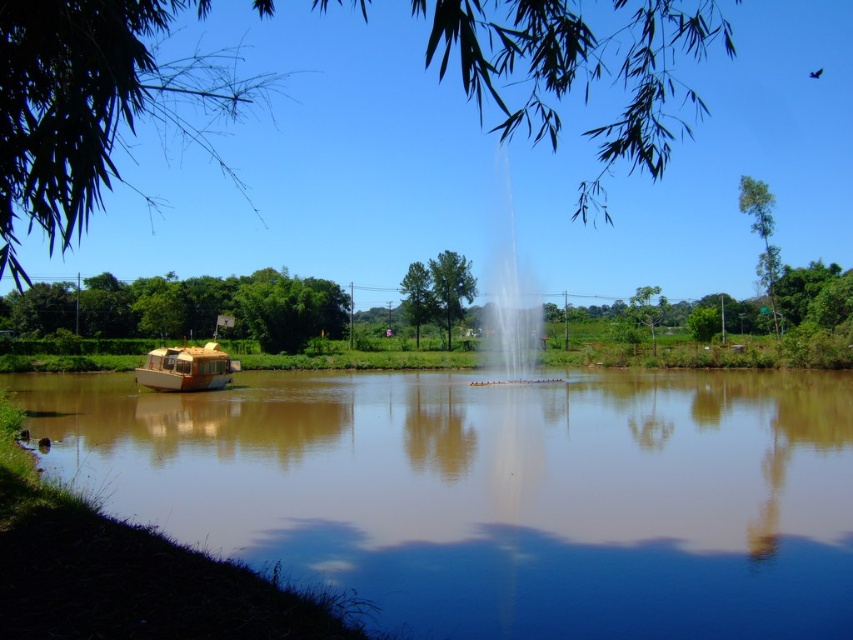
Who is lower down, green leafy tree at upper center or wooden boat at left?

wooden boat at left

Can you confirm if green leafy tree at upper center is positioned to the right of wooden boat at left?

Yes, green leafy tree at upper center is to the right of wooden boat at left.

This screenshot has height=640, width=853. Describe the element at coordinates (91, 106) in the screenshot. I see `green leafy tree at upper center` at that location.

Locate an element on the screen. This screenshot has height=640, width=853. green leafy tree at upper center is located at coordinates (91, 106).

Who is higher up, clear water fountain at center or green leafy tree at center?

clear water fountain at center is higher up.

Is clear water fountain at center closer to camera compared to green leafy tree at center?

Yes, it is in front of green leafy tree at center.

This screenshot has height=640, width=853. What are the coordinates of `clear water fountain at center` in the screenshot? It's located at (509, 300).

The width and height of the screenshot is (853, 640). I want to click on clear water fountain at center, so click(509, 300).

Can you confirm if brown matte river at center is thinner than green matte tree at center?

No, brown matte river at center is not thinner than green matte tree at center.

Based on the photo, does brown matte river at center have a greater width compared to green matte tree at center?

Yes, brown matte river at center is wider than green matte tree at center.

Between point (811, 429) and point (416, 282), which one is positioned behind?

The point (416, 282) is more distant.

Locate an element on the screen. This screenshot has height=640, width=853. brown matte river at center is located at coordinates (492, 492).